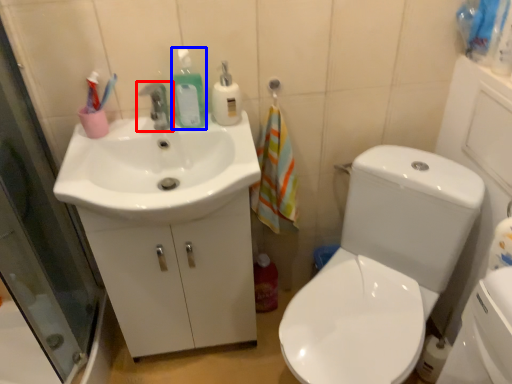
Question: Among these objects, which one is nearest to the camera, tap (highlighted by a red box) or cleaning product (highlighted by a blue box)?

Choices:
 (A) tap
 (B) cleaning product

Answer: (A)